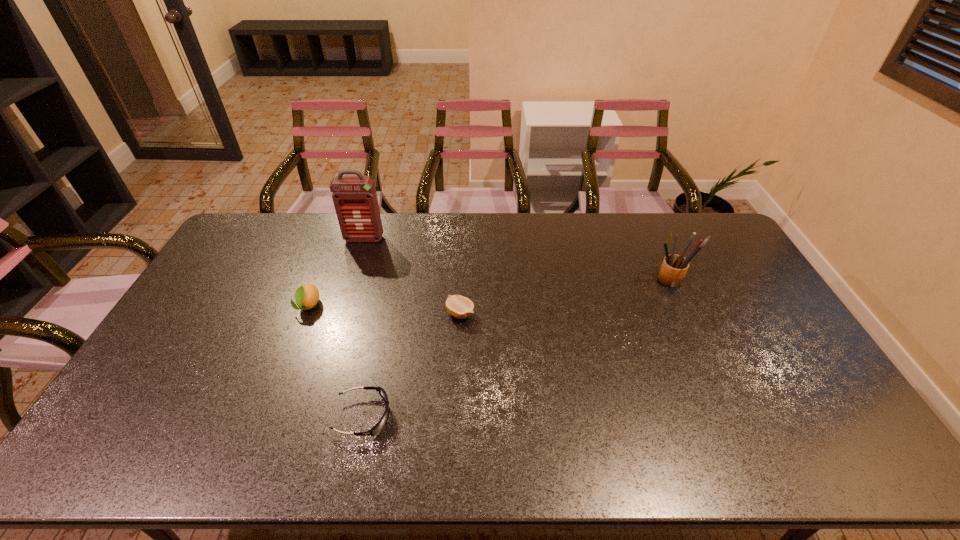
Where is `the first-aid kit`? Image resolution: width=960 pixels, height=540 pixels. the first-aid kit is located at coordinates (355, 200).

Image resolution: width=960 pixels, height=540 pixels. In order to click on the tallest object in this screenshot , I will do `click(355, 200)`.

I want to click on the fourth shortest object, so click(x=674, y=267).

Locate an element on the screen. This screenshot has width=960, height=540. pencil box is located at coordinates (674, 267).

Locate an element on the screen. This screenshot has width=960, height=540. the taller lemon is located at coordinates (307, 296).

The image size is (960, 540). I want to click on the third shortest object, so click(x=307, y=296).

Locate an element on the screen. the fourth object from left to right is located at coordinates (460, 307).

Locate an element on the screen. the right lemon is located at coordinates (460, 307).

Find the location of a particular element. This screenshot has height=540, width=960. goggles is located at coordinates (378, 427).

Identify the location of free region located 0.360m on the front-facing side of the farthest object. (341, 315).